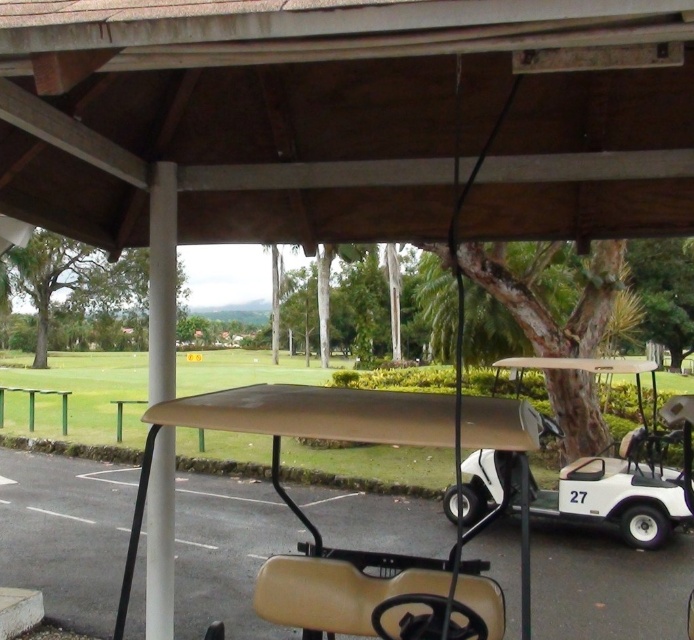
Question: Can you confirm if beige matte golf cart at center is thinner than white matte golf cart at center?

Choices:
 (A) no
 (B) yes

Answer: (A)

Question: Does beige matte golf cart at center come in front of white matte golf cart at center?

Choices:
 (A) yes
 (B) no

Answer: (A)

Question: Which object is closer to the camera taking this photo?

Choices:
 (A) white matte golf cart at center
 (B) beige matte golf cart at center

Answer: (B)

Question: Which point is closer to the camera?

Choices:
 (A) white matte golf cart at center
 (B) beige matte golf cart at center

Answer: (B)

Question: Among these points, which one is nearest to the camera?

Choices:
 (A) (677, 502)
 (B) (355, 588)

Answer: (B)

Question: Does beige matte golf cart at center have a lesser width compared to white matte golf cart at center?

Choices:
 (A) yes
 (B) no

Answer: (B)